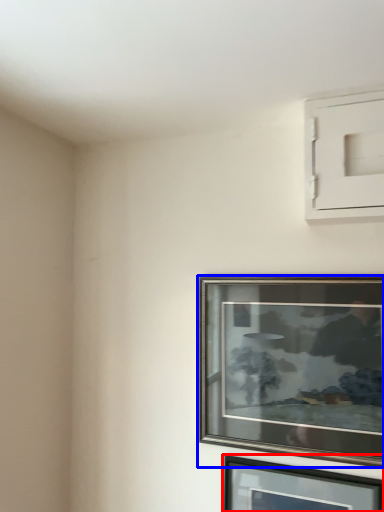
Question: Which object is further to the camera taking this photo, picture frame (highlighted by a red box) or picture frame (highlighted by a blue box)?

Choices:
 (A) picture frame
 (B) picture frame

Answer: (B)